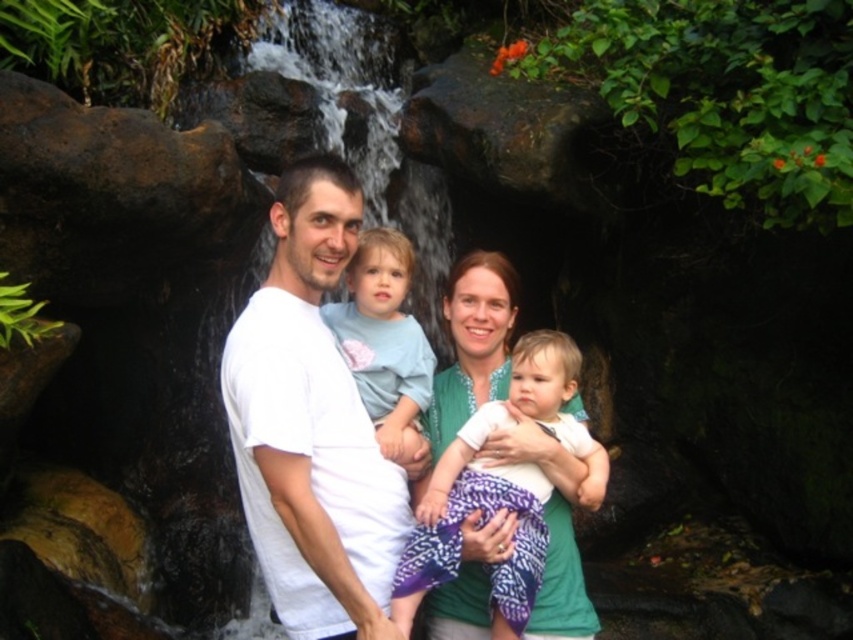
You are a photographer trying to capture a group photo of the family. You want to ensure that both the white cotton shirt at center and the light blue cotton shirt at center are fully visible in the frame. Based on their positions, which shirt should you focus on to ensure both are in focus?

Since the white cotton shirt at center is wider than the light blue cotton shirt at center, focusing on the wider white cotton shirt at center would help ensure both are in focus as it occupies more space in the frame.

You are a photographer trying to capture a group photo of the family. You notice the white cotton shirt at center and the light blue cotton shirt at center. Which shirt should you adjust to ensure both are centered in the frame?

The white cotton shirt at center is positioned on the left side of the light blue cotton shirt at center. To center both shirts, you should move the white cotton shirt at center slightly to the right and the light blue cotton shirt at center slightly to the left until they are aligned centrally.

You are a photographer trying to capture a closeup of the white cotton shirt at center. You have a zoom lens that can focus on a specific point. The point you want to focus on is point (311, 426). Is this point located on the white cotton shirt at center?

Yes, the point (311, 426) is on the white cotton shirt at center, so focusing there will capture the desired area.